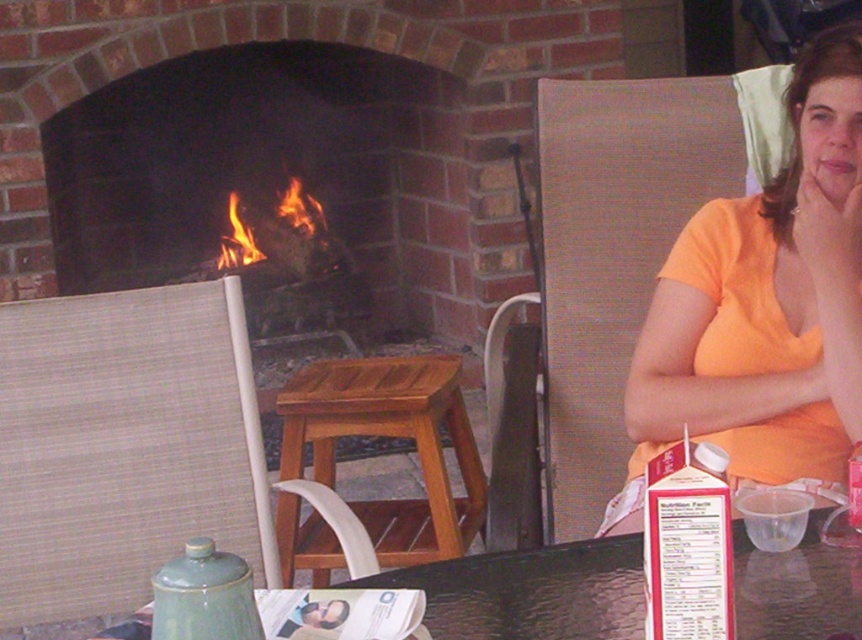
You are standing in the scene and need to locate the orange cotton shirt at upper right. According to the coordinates provided, where exactly should you look to find it?

The orange cotton shirt at upper right is located at coordinates point (x=764, y=307).